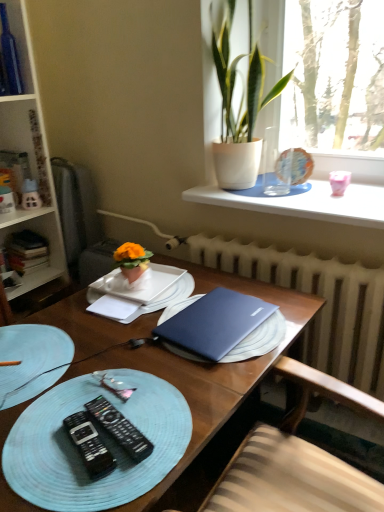
The width and height of the screenshot is (384, 512). What are the coordinates of `vacant area that lies between satin blue laptop at center and black plastic remote control at lower left, which ranks as the second remote control in left-to-right order` in the screenshot? It's located at tap(163, 388).